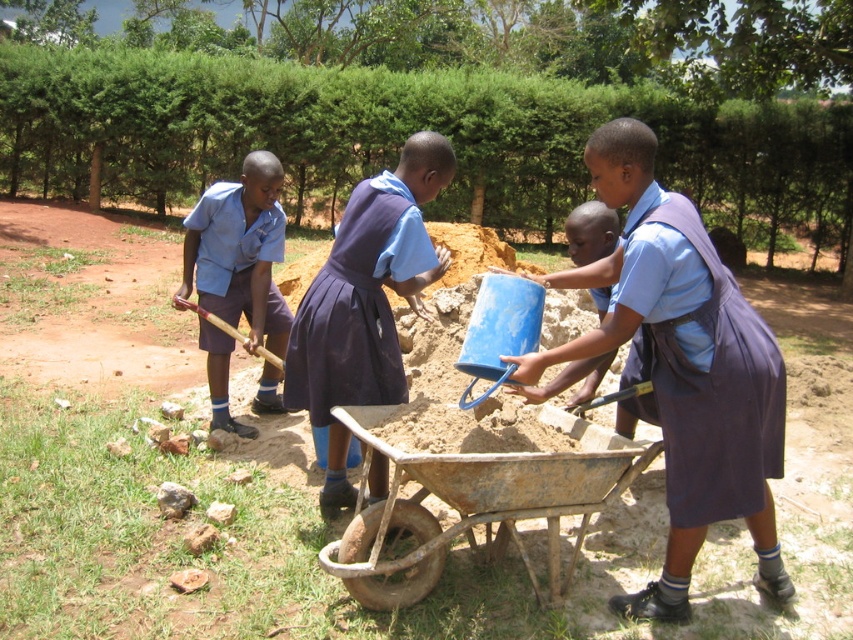
Who is higher up, blue matte bucket at center or blue fabric dress at center?

blue fabric dress at center is higher up.

Between point (656, 195) and point (784, 376), which one is positioned behind?

Positioned behind is point (784, 376).

The width and height of the screenshot is (853, 640). What are the coordinates of `blue matte bucket at center` in the screenshot? It's located at (680, 369).

You are a GUI agent. You are given a task and a screenshot of the screen. Output one action in this format:
    pyautogui.click(x=<x>, y=<y>)
    Task: Click on the blue matte bucket at center
    The width and height of the screenshot is (853, 640).
    Given the screenshot: What is the action you would take?
    tap(680, 369)

Between point (672, 269) and point (241, 289), which one is positioned in front?

Point (672, 269)

Does point (601, 282) lie behind point (223, 198)?

No, it is not.

At what (x,y) coordinates should I click in order to perform the action: click on blue matte bucket at center. Please return your answer as a coordinate pair (x, y). The image size is (853, 640). Looking at the image, I should click on (680, 369).

Consider the image. Who is shorter, rusty metal cart at center or purple fabric dress at center?

With less height is rusty metal cart at center.

Who is more distant from viewer, (363, 561) or (370, 269)?

Positioned behind is point (370, 269).

Between point (646, 461) and point (345, 396), which one is positioned behind?

Positioned behind is point (345, 396).

At what (x,y) coordinates should I click in order to perform the action: click on rusty metal cart at center. Please return your answer as a coordinate pair (x, y). Looking at the image, I should click on (479, 506).